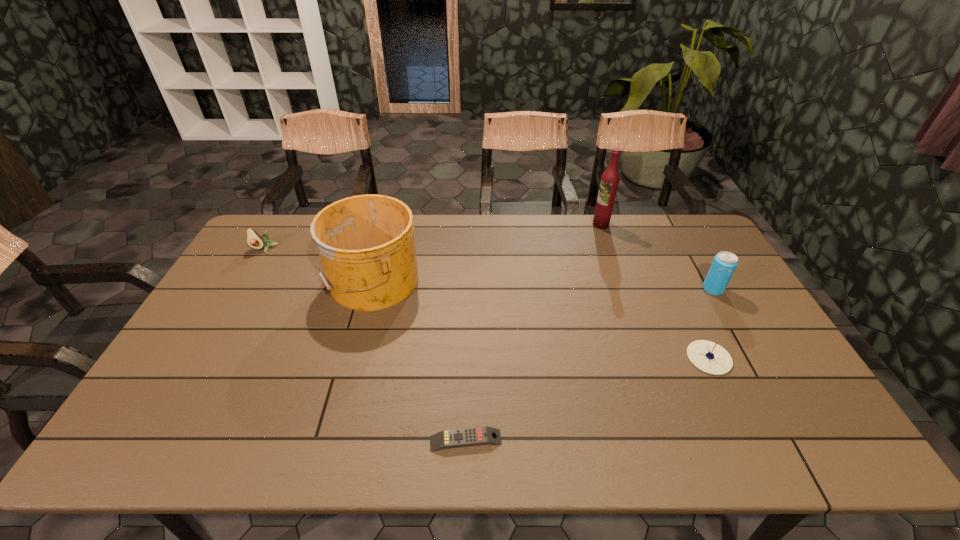
I want to click on free space that satisfies the following two spatial constraints: 1. on the seed side of the leftmost object; 2. on the right side of the soda can, so click(x=240, y=289).